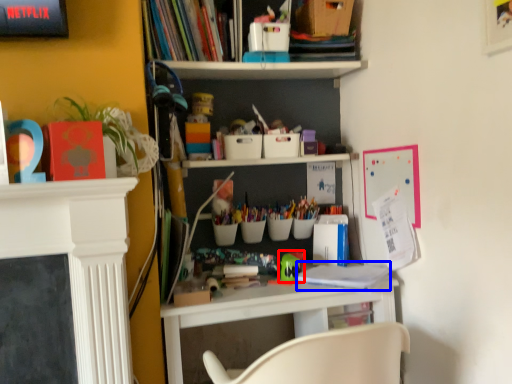
Question: Which point is closer to the camera, toy (highlighted by a red box) or book (highlighted by a blue box)?

Choices:
 (A) toy
 (B) book

Answer: (B)